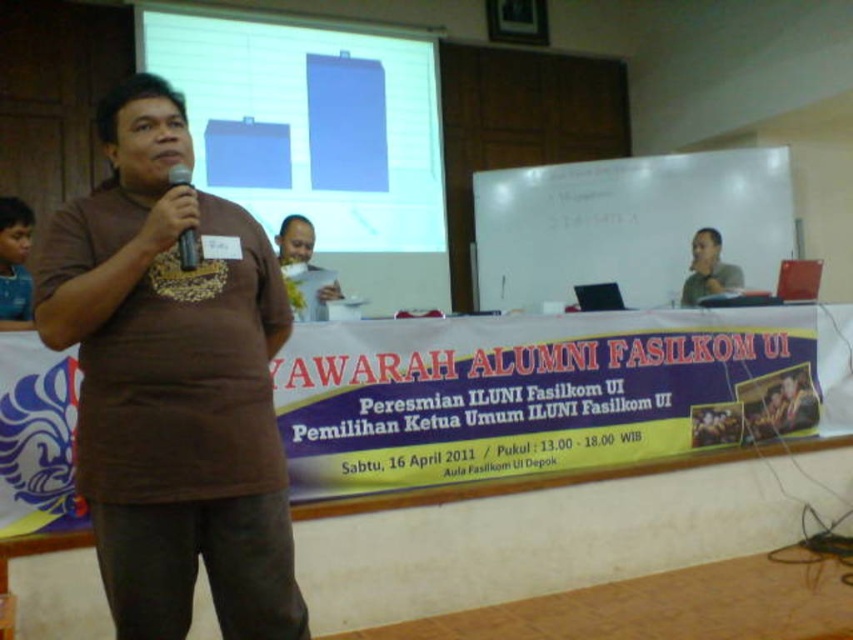
You are a photographer adjusting your camera settings. You notice two points in the scene marked as point 1 at coordinates [250,44] and point 2 at [198,259]. Which point is closer to your camera lens?

Point 1 at coordinates [250,44] is closer to the camera lens than point 2 at [198,259].

You are an event organizer checking the setup for the upcoming speech. You need to ensure that the matte blue projector screen at upper center and the black matte microphone at left are positioned correctly. Based on their heights, which object is taller?

The matte blue projector screen at upper center is taller than the black matte microphone at left.